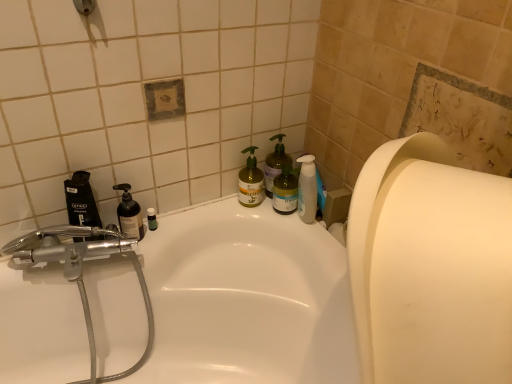
The width and height of the screenshot is (512, 384). I want to click on vacant area that is situated to the right of black plastic mouthwash at left, so click(x=158, y=240).